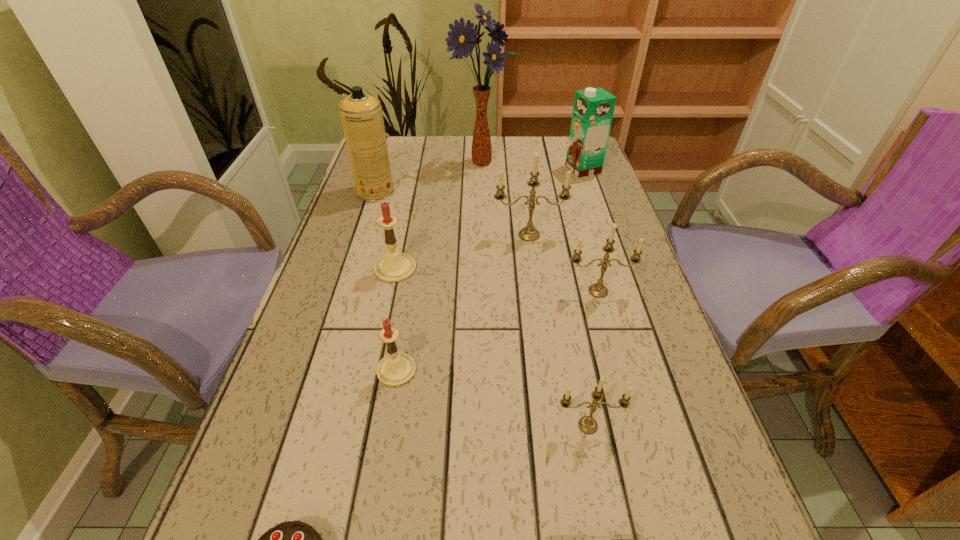
What are the coordinates of `free region at the left edge` in the screenshot? It's located at (258, 444).

In the image, there is a desktop. Identify the location of vacant region at the right edge. (587, 252).

Find the location of `blank region between the farthest metallic candle and the nearer red candle`. blank region between the farthest metallic candle and the nearer red candle is located at coordinates pyautogui.click(x=463, y=302).

The width and height of the screenshot is (960, 540). Find the location of `vacant area that lies between the carton and the second nearest candle`. vacant area that lies between the carton and the second nearest candle is located at coordinates (490, 269).

Locate an element on the screen. free space that is in between the second farthest metallic candle and the carton is located at coordinates (590, 230).

The width and height of the screenshot is (960, 540). Identify the location of free space between the farthest candle and the second farthest candle. (462, 252).

The width and height of the screenshot is (960, 540). I want to click on unoccupied position between the fourth nearest object and the biggest metallic candle, so click(x=463, y=302).

The image size is (960, 540). Find the location of `empty space that is in between the third farthest candle and the carton`. empty space that is in between the third farthest candle and the carton is located at coordinates tap(590, 230).

Find the location of `free point between the bigger red candle and the eighth farthest object`. free point between the bigger red candle and the eighth farthest object is located at coordinates (492, 347).

Find the location of a particular element. This screenshot has height=540, width=960. object that stands as the fifth closest to the second farthest candle is located at coordinates (463, 39).